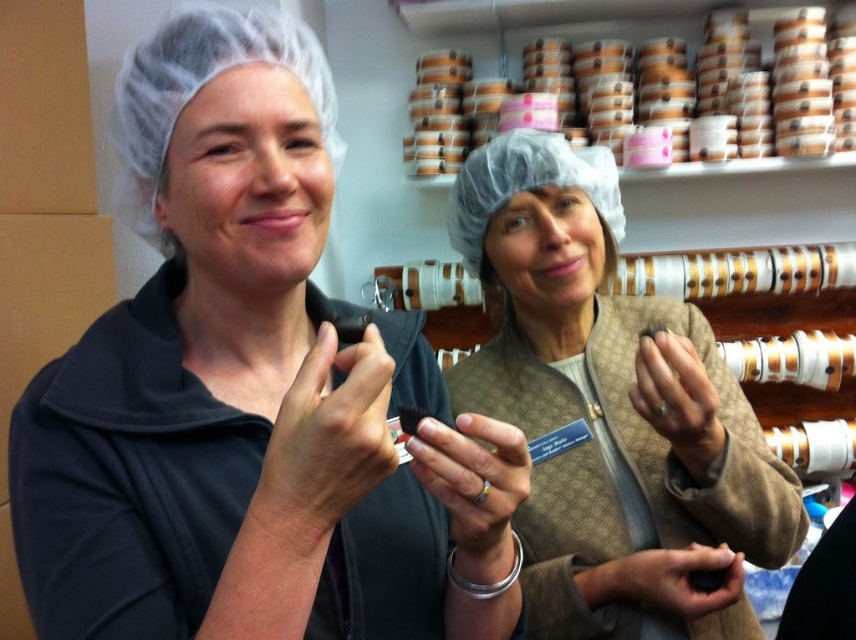
You are a quality inspector in a chocolate factory. You need to check the position of the matte black chocolate at center relative to the matte brown jacket at center. Based on the scene, is the chocolate above or below the jacket?

The matte black chocolate at center is located above the matte brown jacket at center, so the chocolate is above the jacket.

What are the coordinates of the matte black chocolate at center?

The coordinates of the matte black chocolate at center are 0.617 on the x axis and 0.293 on the y axis.